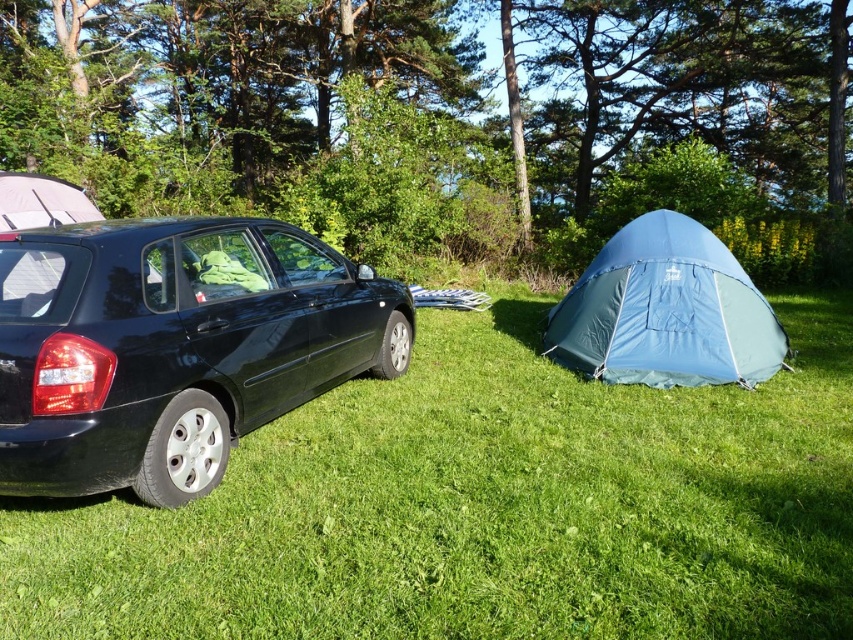
You are planning to set up a tent for a family of four. Given the scene, which tent between the blue fabric tent at right and the matte gray tent at left would be more suitable for accommodating everyone?

The blue fabric tent at right is bigger than the matte gray tent at left, so it would be more suitable for accommodating a family of four.

You are standing at the point marked by the coordinates point (x=483, y=506) in the image. Based on the camping scene described, what is the immediate surface you would be standing on?

The point (x=483, y=506) corresponds to green grass at lower left, so you would be standing on green grass at lower left.

You are setting up a campsite and need to place a small picnic basket. You have two spots available on the green grass at lower left and the matte gray tent at left. Which location has more space to accommodate the basket?

The matte gray tent at left has more space since the green grass at lower left is smaller in size compared to the matte gray tent at left.